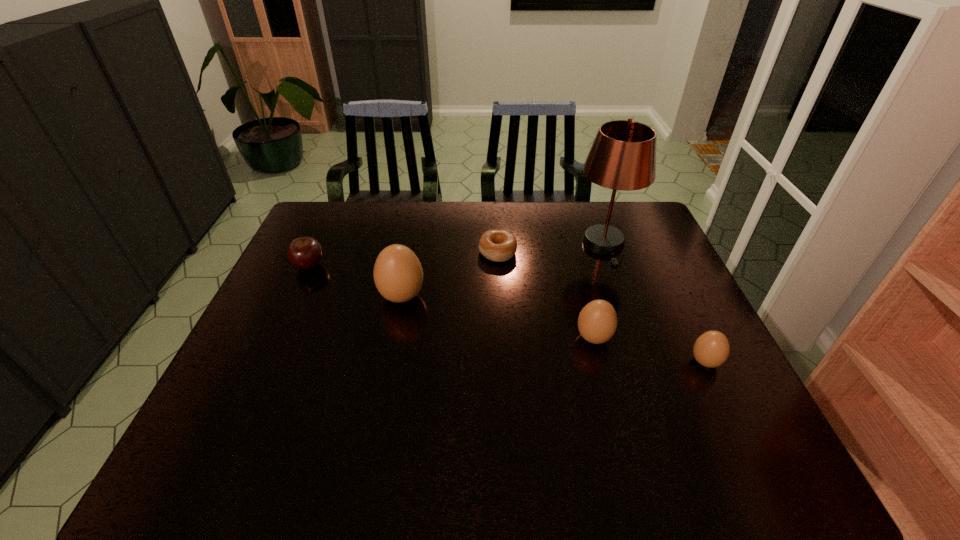
You are a GUI agent. You are given a task and a screenshot of the screen. Output one action in this format:
    pyautogui.click(x=<x>, y=<y>)
    Task: Click on the tallest boiled egg
    
    Given the screenshot: What is the action you would take?
    pyautogui.click(x=398, y=275)

At what (x,y) coordinates should I click in order to perform the action: click on the fifth object from right to left. Please return your answer as a coordinate pair (x, y). This screenshot has height=540, width=960. Looking at the image, I should click on (398, 275).

At what (x,y) coordinates should I click in order to perform the action: click on the second tallest boiled egg. Please return your answer as a coordinate pair (x, y). The width and height of the screenshot is (960, 540). Looking at the image, I should click on (597, 322).

You are a GUI agent. You are given a task and a screenshot of the screen. Output one action in this format:
    pyautogui.click(x=<x>, y=<y>)
    Task: Click on the second boiled egg from right to left
    
    Given the screenshot: What is the action you would take?
    pyautogui.click(x=597, y=322)

The image size is (960, 540). What are the coordinates of `the rightmost object` in the screenshot? It's located at (711, 349).

Find the location of a particular element. the shortest boiled egg is located at coordinates (711, 349).

Find the location of `the tallest object`. the tallest object is located at coordinates (623, 155).

The height and width of the screenshot is (540, 960). What are the coordinates of `bagel` in the screenshot? It's located at coord(496,245).

You are a GUI agent. You are given a task and a screenshot of the screen. Output one action in this format:
    pyautogui.click(x=<x>, y=<y>)
    Task: Click on the shortest object
    This screenshot has height=540, width=960.
    Given the screenshot: What is the action you would take?
    pyautogui.click(x=496, y=245)

Locate an element on the screen. This screenshot has width=960, height=540. the leftmost object is located at coordinates (305, 253).